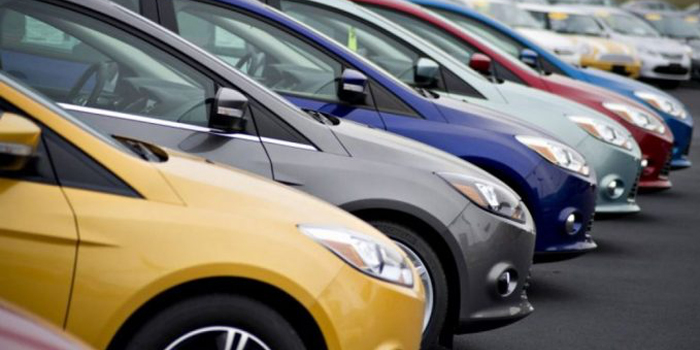
Image resolution: width=700 pixels, height=350 pixels. I want to click on mirror, so click(217, 106), click(21, 129), click(344, 78), click(420, 68), click(472, 59), click(518, 51), click(612, 28).